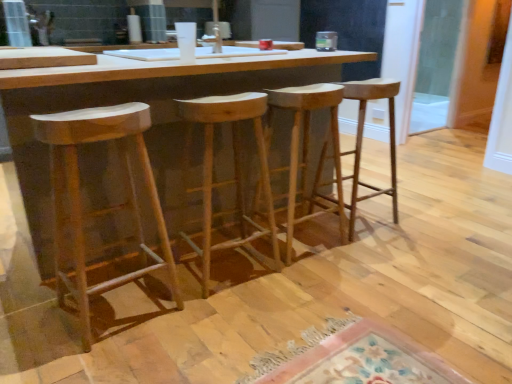
The height and width of the screenshot is (384, 512). Identify the location of free space in front of natural wood stool at center, which appears as the 3th stool when viewed from the right. (231, 316).